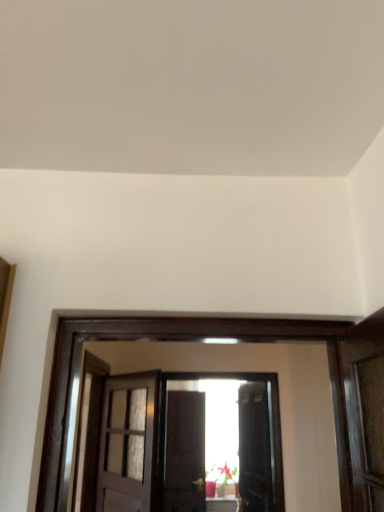
Question: From the image's perspective, is matte white door at center, the second door positioned from the right, above or below matte black door at center, the first door from the right?

Choices:
 (A) below
 (B) above

Answer: (B)

Question: From a real-world perspective, relative to matte black door at center, the 1th door from the back, is matte white door at center, which is counted as the first door, starting from the left, vertically above or below?

Choices:
 (A) below
 (B) above

Answer: (B)

Question: Is matte white door at center, marked as the 2th door in a back-to-front arrangement, wider or thinner than matte black door at center, marked as the second door in a left-to-right arrangement?

Choices:
 (A) wide
 (B) thin

Answer: (B)

Question: In the image, is matte black door at center, the first door from the right, positioned in front of or behind matte white door at center, the second door positioned from the right?

Choices:
 (A) front
 (B) behind

Answer: (B)

Question: Based on their positions, is matte black door at center, marked as the second door in a left-to-right arrangement, located to the left or right of matte white door at center, the second door positioned from the right?

Choices:
 (A) right
 (B) left

Answer: (A)

Question: From a real-world perspective, is matte black door at center, the 1th door from the back, above or below matte white door at center, the second door positioned from the right?

Choices:
 (A) above
 (B) below

Answer: (B)

Question: From the image's perspective, relative to matte white door at center, the second door positioned from the right, is matte black door at center, the 1th door from the back, above or below?

Choices:
 (A) above
 (B) below

Answer: (B)